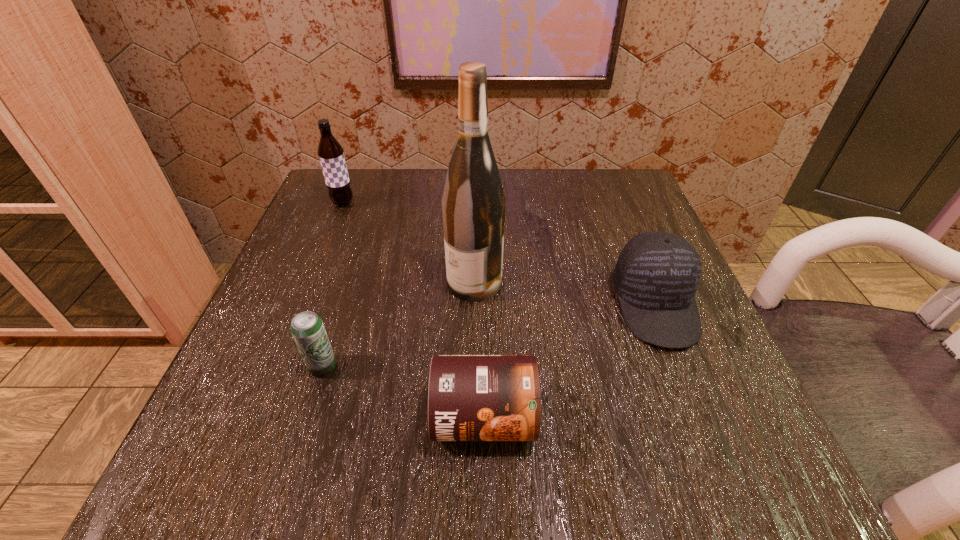
Image resolution: width=960 pixels, height=540 pixels. I want to click on the tallest object, so click(473, 203).

The height and width of the screenshot is (540, 960). I want to click on the leftmost object, so click(331, 154).

Image resolution: width=960 pixels, height=540 pixels. Identify the location of the fourth shortest object. pyautogui.click(x=331, y=154).

This screenshot has height=540, width=960. In order to click on the rightmost object in this screenshot , I will do `click(657, 274)`.

At what (x,y) coordinates should I click in order to perform the action: click on beer can. Please return your answer as a coordinate pair (x, y). Image resolution: width=960 pixels, height=540 pixels. Looking at the image, I should click on (307, 328).

Identify the location of the second nearest object. (307, 328).

Locate an element on the screen. This screenshot has width=960, height=540. the nearest object is located at coordinates (470, 397).

You are a GUI agent. You are given a task and a screenshot of the screen. Output one action in this format:
    pyautogui.click(x=<x>, y=<y>)
    Task: Click on the free location located 0.130m on the front of the wine bottle
    This screenshot has height=540, width=960.
    Given the screenshot: What is the action you would take?
    click(x=473, y=363)

Image resolution: width=960 pixels, height=540 pixels. I want to click on free location located 0.210m on the right of the root beer, so click(448, 203).

I want to click on vacant space positioned at the front of the baseball cap where the brim is located, so click(700, 417).